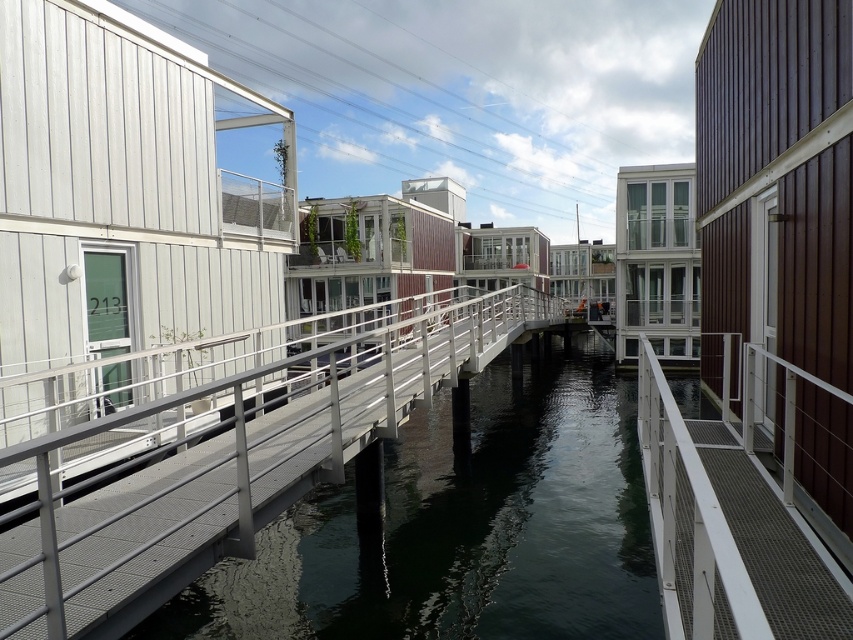
Question: Which object is closer to the camera taking this photo?

Choices:
 (A) transparent glass water at center
 (B) metal mesh dock at center

Answer: (B)

Question: Is transparent glass water at center positioned behind metal mesh dock at center?

Choices:
 (A) yes
 (B) no

Answer: (A)

Question: In this image, where is transparent glass water at center located relative to metal mesh dock at center?

Choices:
 (A) left
 (B) right

Answer: (B)

Question: Can you confirm if transparent glass water at center is positioned below metal mesh dock at center?

Choices:
 (A) no
 (B) yes

Answer: (B)